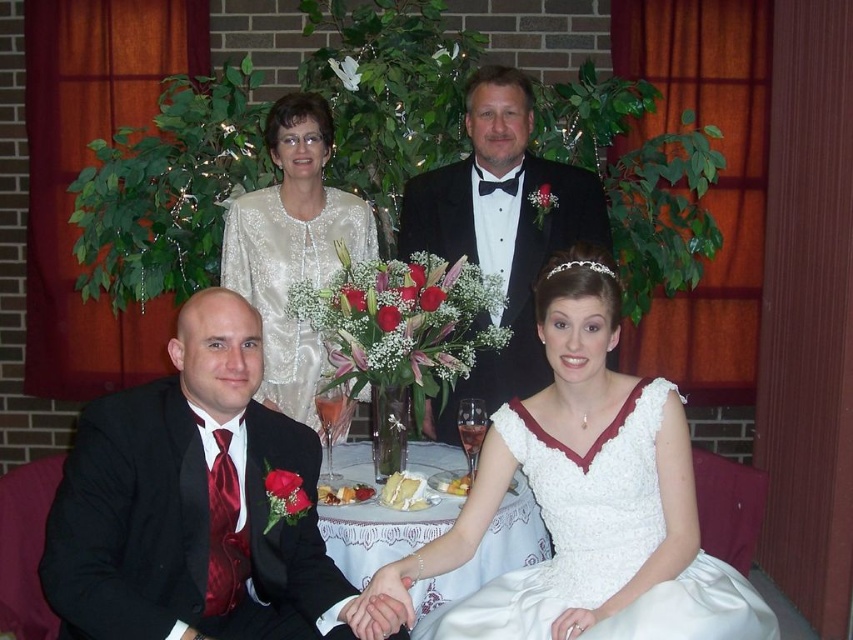
Does matte black tuxedo at upper center have a greater height compared to satin white dress at upper center?

Correct, matte black tuxedo at upper center is much taller as satin white dress at upper center.

From the picture: Between matte black tuxedo at upper center and satin white dress at upper center, which one has more height?

Standing taller between the two is matte black tuxedo at upper center.

Is point (527, 220) positioned in front of point (310, 282)?

No, it is behind (310, 282).

The image size is (853, 640). Find the location of `matte black tuxedo at upper center`. matte black tuxedo at upper center is located at coordinates (500, 228).

Is white satin dress at lower center smaller than matte black tuxedo at upper center?

No, white satin dress at lower center is not smaller than matte black tuxedo at upper center.

Between white satin dress at lower center and matte black tuxedo at upper center, which one is positioned higher?

matte black tuxedo at upper center

What are the coordinates of `white satin dress at lower center` in the screenshot? It's located at (572, 522).

This screenshot has height=640, width=853. What do you see at coordinates (194, 504) in the screenshot?
I see `shiny red tie at lower left` at bounding box center [194, 504].

From the picture: Is shiny red tie at lower left positioned behind white satin dress at lower center?

No, shiny red tie at lower left is closer to the viewer.

Where is `shiny red tie at lower left`? Image resolution: width=853 pixels, height=640 pixels. shiny red tie at lower left is located at coordinates (194, 504).